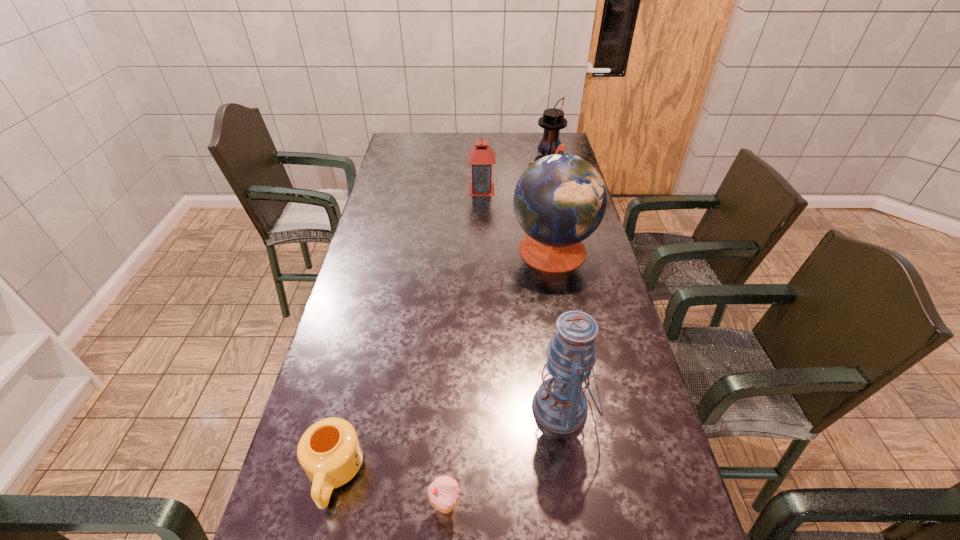
Where can I find a free point located 0.350m above the farthest object, indicating its light source? Please provide its 2D coordinates. Your answer should be formatted as a tuple, i.e. [(x, y)], where the tuple contains the x and y coordinates of a point satisfying the conditions above.

[(448, 173)]

Identify some points in free space located 0.110m above the farthest object, indicating its light source. Please provide its 2D coordinates. Your answer should be formatted as a tuple, i.e. [(x, y)], where the tuple contains the x and y coordinates of a point satisfying the conditions above.

[(503, 173)]

Where can I find a free point located 0.350m above the farthest object, indicating its light source? Please provide its 2D coordinates. Your answer should be formatted as a tuple, i.e. [(x, y)], where the tuple contains the x and y coordinates of a point satisfying the conditions above.

[(448, 173)]

The image size is (960, 540). Identify the location of vacant region located 0.400m on the front-facing side of the nearest lantern. (372, 408).

Locate an element on the screen. The image size is (960, 540). vacant space located on the front-facing side of the nearest lantern is located at coordinates (492, 408).

Identify the location of vacant space located 0.190m on the front-facing side of the nearest lantern. Image resolution: width=960 pixels, height=540 pixels. (455, 408).

Locate an element on the screen. free spot located on the front of the second nearest lantern is located at coordinates (482, 254).

This screenshot has width=960, height=540. Find the location of `free space located 0.050m on the back of the icecream`. free space located 0.050m on the back of the icecream is located at coordinates (448, 468).

Locate an element on the screen. The width and height of the screenshot is (960, 540). object located in the left edge section of the desktop is located at coordinates (329, 451).

Identify the location of globe positioned at the right edge. (560, 200).